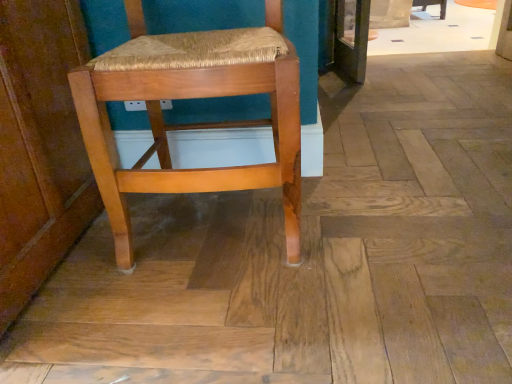
Question: Does point (283, 125) appear closer or farther from the camera than point (445, 0)?

Choices:
 (A) closer
 (B) farther

Answer: (A)

Question: From their relative heights in the image, would you say wooden woven seat at center, the first chair viewed from the left, is taller or shorter than wooden chair at center, which appears as the second chair when viewed from the left?

Choices:
 (A) short
 (B) tall

Answer: (B)

Question: From the image's perspective, is wooden woven seat at center, which is the second chair from top to bottom, above or below wooden chair at center, the 2th chair positioned from the front?

Choices:
 (A) below
 (B) above

Answer: (A)

Question: From their relative heights in the image, would you say wooden chair at center, positioned as the second chair in bottom-to-top order, is taller or shorter than wooden woven seat at center, positioned as the second chair in right-to-left order?

Choices:
 (A) short
 (B) tall

Answer: (A)

Question: In the image, is wooden chair at center, which appears as the first chair when viewed from the right, positioned in front of or behind wooden woven seat at center, arranged as the 1th chair when ordered from the bottom?

Choices:
 (A) behind
 (B) front

Answer: (A)

Question: Looking at the image, does wooden chair at center, which appears as the second chair when viewed from the left, seem bigger or smaller compared to wooden woven seat at center, arranged as the 1th chair when ordered from the bottom?

Choices:
 (A) big
 (B) small

Answer: (B)

Question: Does point (425, 4) appear closer or farther from the camera than point (207, 87)?

Choices:
 (A) closer
 (B) farther

Answer: (B)